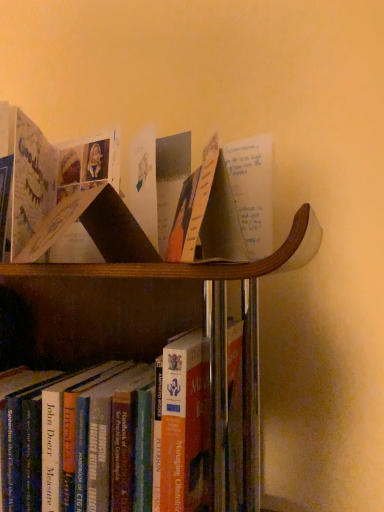
The height and width of the screenshot is (512, 384). What do you see at coordinates (52, 172) in the screenshot?
I see `matte paper book at center, which is counted as the second book, starting from the bottom` at bounding box center [52, 172].

Image resolution: width=384 pixels, height=512 pixels. What do you see at coordinates (109, 435) in the screenshot?
I see `hardcover book at lower center, which is the first book from bottom to top` at bounding box center [109, 435].

You are a GUI agent. You are given a task and a screenshot of the screen. Output one action in this format:
    pyautogui.click(x=<x>, y=<y>)
    Task: Click on the matte paper book at center
    The image size is (384, 512).
    Given the screenshot: What is the action you would take?
    pyautogui.click(x=207, y=214)

Considering the relative positions of hardcover book at lower center, which is counted as the 2th book, starting from the top, and matte paper book at center in the image provided, is hardcover book at lower center, which is counted as the 2th book, starting from the top, to the right of matte paper book at center from the viewer's perspective?

No.

Is hardcover book at lower center, which is counted as the 2th book, starting from the top, shorter than matte paper book at center?

No, hardcover book at lower center, which is counted as the 2th book, starting from the top, is not shorter than matte paper book at center.

Which object is wider, hardcover book at lower center, which is counted as the 2th book, starting from the top, or matte paper book at center?

hardcover book at lower center, which is counted as the 2th book, starting from the top, is wider.

Between hardcover book at lower center, which is the first book from bottom to top, and matte paper book at center, which one is positioned behind?

hardcover book at lower center, which is the first book from bottom to top, is further from the camera.

Image resolution: width=384 pixels, height=512 pixels. Identify the location of paperback book that appears above the matte paper book at center, which is counted as the second book, starting from the bottom (from the image's perspective). (207, 214).

Can you see matte paper book at center touching matte paper book at center, marked as the 1th book in a top-to-bottom arrangement?

No, matte paper book at center is not with matte paper book at center, marked as the 1th book in a top-to-bottom arrangement.

Considering the positions of points (229, 192) and (31, 124), is point (229, 192) farther from camera compared to point (31, 124)?

No, (229, 192) is closer to viewer.

Who is taller, matte paper book at center or matte paper book at center, marked as the 1th book in a top-to-bottom arrangement?

With more height is matte paper book at center.

Is matte paper book at center, which is counted as the second book, starting from the bottom, with matte paper book at center?

matte paper book at center, which is counted as the second book, starting from the bottom, and matte paper book at center are clearly separated.

Who is bigger, matte paper book at center, which is counted as the second book, starting from the bottom, or matte paper book at center?

matte paper book at center, which is counted as the second book, starting from the bottom, is bigger.

Does matte paper book at center, marked as the 1th book in a top-to-bottom arrangement, appear on the right side of matte paper book at center?

Incorrect, matte paper book at center, marked as the 1th book in a top-to-bottom arrangement, is not on the right side of matte paper book at center.

Based on the photo, is matte paper book at center, which is counted as the second book, starting from the bottom, outside of matte paper book at center?

Indeed, matte paper book at center, which is counted as the second book, starting from the bottom, is completely outside matte paper book at center.

From a real-world perspective, relative to matte paper book at center, which is counted as the second book, starting from the bottom, is hardcover book at lower center, which is the first book from bottom to top, vertically above or below?

From a real-world perspective, hardcover book at lower center, which is the first book from bottom to top, is physically below matte paper book at center, which is counted as the second book, starting from the bottom.

Locate an element on the screen. The height and width of the screenshot is (512, 384). book lying on the left of matte paper book at center, which is counted as the second book, starting from the bottom is located at coordinates (109, 435).

Considering the positions of objects hardcover book at lower center, which is the first book from bottom to top, and matte paper book at center, marked as the 1th book in a top-to-bottom arrangement, in the image provided, who is more to the right, hardcover book at lower center, which is the first book from bottom to top, or matte paper book at center, marked as the 1th book in a top-to-bottom arrangement,?

Positioned to the right is matte paper book at center, marked as the 1th book in a top-to-bottom arrangement.

Considering the sizes of objects matte paper book at center, marked as the 1th book in a top-to-bottom arrangement, and hardcover book at lower center, which is counted as the 2th book, starting from the top, in the image provided, who is thinner, matte paper book at center, marked as the 1th book in a top-to-bottom arrangement, or hardcover book at lower center, which is counted as the 2th book, starting from the top,?

Thinner between the two is matte paper book at center, marked as the 1th book in a top-to-bottom arrangement.

What's the angular difference between matte paper book at center, marked as the 1th book in a top-to-bottom arrangement, and hardcover book at lower center, which is the first book from bottom to top,'s facing directions?

There is a 39.5-degree angle between the facing directions of matte paper book at center, marked as the 1th book in a top-to-bottom arrangement, and hardcover book at lower center, which is the first book from bottom to top.

Is matte paper book at center, which is counted as the second book, starting from the bottom, behind hardcover book at lower center, which is the first book from bottom to top?

Yes, it is.

From a real-world perspective, is matte paper book at center, which is counted as the second book, starting from the bottom, physically located above or below hardcover book at lower center, which is the first book from bottom to top?

Clearly, from a real-world perspective, matte paper book at center, which is counted as the second book, starting from the bottom, is above hardcover book at lower center, which is the first book from bottom to top.

From a real-world perspective, is matte paper book at center positioned above or below hardcover book at lower center, which is the first book from bottom to top?

From a real-world perspective, matte paper book at center is physically above hardcover book at lower center, which is the first book from bottom to top.

Who is shorter, matte paper book at center or hardcover book at lower center, which is the first book from bottom to top?

matte paper book at center.

What's the angular difference between matte paper book at center and hardcover book at lower center, which is counted as the 2th book, starting from the top,'s facing directions?

66.3 degrees.

Does matte paper book at center have a smaller size compared to hardcover book at lower center, which is the first book from bottom to top?

Yes.

At what (x,y) coordinates should I click in order to perform the action: click on the 1st book behind the matte paper book at center, counting from the anchor's position. Please return your answer as a coordinate pair (x, y). This screenshot has height=512, width=384. Looking at the image, I should click on (109, 435).

From the image's perspective, starting from the matte paper book at center, which book is the 1st one below? Please provide its 2D coordinates.

[(52, 172)]

Looking at the image, which one is located closer to matte paper book at center, matte paper book at center, which is counted as the second book, starting from the bottom, or hardcover book at lower center, which is the first book from bottom to top?

The object closer to matte paper book at center is hardcover book at lower center, which is the first book from bottom to top.

Estimate the real-world distances between objects in this image. Which object is further from hardcover book at lower center, which is counted as the 2th book, starting from the top, matte paper book at center, which is counted as the second book, starting from the bottom, or matte paper book at center?

Based on the image, matte paper book at center, which is counted as the second book, starting from the bottom, appears to be further to hardcover book at lower center, which is counted as the 2th book, starting from the top.

From the image, which object appears to be nearer to matte paper book at center, marked as the 1th book in a top-to-bottom arrangement, hardcover book at lower center, which is the first book from bottom to top, or matte paper book at center?

Among the two, matte paper book at center is located nearer to matte paper book at center, marked as the 1th book in a top-to-bottom arrangement.

From the image, which object appears to be farther from matte paper book at center, hardcover book at lower center, which is the first book from bottom to top, or matte paper book at center, which is counted as the second book, starting from the bottom?

The object further to matte paper book at center is matte paper book at center, which is counted as the second book, starting from the bottom.

When comparing their distances from matte paper book at center, which is counted as the second book, starting from the bottom, does matte paper book at center or hardcover book at lower center, which is counted as the 2th book, starting from the top, seem closer?

Among the two, matte paper book at center is located nearer to matte paper book at center, which is counted as the second book, starting from the bottom.

Estimate the real-world distances between objects in this image. Which object is closer to hardcover book at lower center, which is the first book from bottom to top, matte paper book at center or matte paper book at center, which is counted as the second book, starting from the bottom?

Among the two, matte paper book at center is located nearer to hardcover book at lower center, which is the first book from bottom to top.

Where is `book between matte paper book at center and hardcover book at lower center, which is the first book from bottom to top, in the up-down direction`? The image size is (384, 512). book between matte paper book at center and hardcover book at lower center, which is the first book from bottom to top, in the up-down direction is located at coordinates (52, 172).